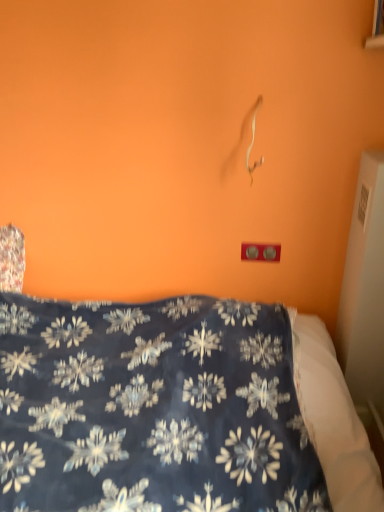
Consider the image. What is the approximate height of dark blue fabric at center?

dark blue fabric at center is 61.79 centimeters in height.

From the picture: Measure the distance between point (356, 458) and camera.

Answer: Point (356, 458) is 1.14 meters away from camera.

The image size is (384, 512). I want to click on dark blue fabric at center, so click(160, 410).

Image resolution: width=384 pixels, height=512 pixels. What do you see at coordinates (160, 410) in the screenshot? I see `dark blue fabric at center` at bounding box center [160, 410].

Where is `matte plastic outlet at center`? matte plastic outlet at center is located at coordinates (260, 252).

The height and width of the screenshot is (512, 384). Describe the element at coordinates (260, 252) in the screenshot. I see `matte plastic outlet at center` at that location.

What are the coordinates of `dark blue fabric at center` in the screenshot? It's located at (160, 410).

Is matte plastic outlet at center to the left of dark blue fabric at center from the viewer's perspective?

In fact, matte plastic outlet at center is to the right of dark blue fabric at center.

Consider the image. Is matte plastic outlet at center positioned before dark blue fabric at center?

No.

Looking at this image, which point is more distant from viewer, (272,249) or (289,466)?

Positioned behind is point (272,249).

From the image's perspective, is matte plastic outlet at center under dark blue fabric at center?

Incorrect, from the image's perspective, matte plastic outlet at center is higher than dark blue fabric at center.

From a real-world perspective, is matte plastic outlet at center beneath dark blue fabric at center?

No, from a real-world perspective, matte plastic outlet at center is not under dark blue fabric at center.

In the scene shown: Can you confirm if matte plastic outlet at center is wider than dark blue fabric at center?

No, matte plastic outlet at center is not wider than dark blue fabric at center.

Considering the relative sizes of matte plastic outlet at center and dark blue fabric at center in the image provided, is matte plastic outlet at center shorter than dark blue fabric at center?

Yes.

Which of these two, matte plastic outlet at center or dark blue fabric at center, is bigger?

dark blue fabric at center is bigger.

Would you say matte plastic outlet at center contains dark blue fabric at center?

That's incorrect, dark blue fabric at center is not inside matte plastic outlet at center.

Is matte plastic outlet at center with dark blue fabric at center?

No.

Is matte plastic outlet at center positioned with its back to dark blue fabric at center?

No, dark blue fabric at center is not at the back of matte plastic outlet at center.

How distant is matte plastic outlet at center from dark blue fabric at center?

The distance of matte plastic outlet at center from dark blue fabric at center is 28.18 inches.

Identify the location of electric outlet behind the dark blue fabric at center. (260, 252).

Considering the positions of objects dark blue fabric at center and matte plastic outlet at center in the image provided, who is more to the left, dark blue fabric at center or matte plastic outlet at center?

dark blue fabric at center.

Does dark blue fabric at center lie in front of matte plastic outlet at center?

Yes, dark blue fabric at center is in front of matte plastic outlet at center.

Considering the points (125, 483) and (243, 245), which point is behind, point (125, 483) or point (243, 245)?

Positioned behind is point (243, 245).

From the image's perspective, is dark blue fabric at center located beneath matte plastic outlet at center?

Yes, from the image's perspective, dark blue fabric at center is below matte plastic outlet at center.

From a real-world perspective, is dark blue fabric at center positioned under matte plastic outlet at center based on gravity?

Indeed, from a real-world perspective, dark blue fabric at center is positioned beneath matte plastic outlet at center.

Considering the relative sizes of dark blue fabric at center and matte plastic outlet at center in the image provided, is dark blue fabric at center thinner than matte plastic outlet at center?

No.

Is dark blue fabric at center taller than matte plastic outlet at center?

Yes, dark blue fabric at center is taller than matte plastic outlet at center.

Looking at this image, considering the relative sizes of dark blue fabric at center and matte plastic outlet at center in the image provided, is dark blue fabric at center smaller than matte plastic outlet at center?

No, dark blue fabric at center is not smaller than matte plastic outlet at center.

Is matte plastic outlet at center a part of dark blue fabric at center?

No, matte plastic outlet at center is not a part of dark blue fabric at center.

Is dark blue fabric at center in contact with matte plastic outlet at center?

There is a gap between dark blue fabric at center and matte plastic outlet at center.

Is dark blue fabric at center turned away from matte plastic outlet at center?

No, matte plastic outlet at center is not at the back of dark blue fabric at center.

Locate an element on the screen. bed that appears below the matte plastic outlet at center (from a real-world perspective) is located at coordinates (160, 410).

You are a GUI agent. You are given a task and a screenshot of the screen. Output one action in this format:
    pyautogui.click(x=<x>, y=<y>)
    Task: Click on the bed on the left of matte plastic outlet at center
    The height and width of the screenshot is (512, 384).
    Given the screenshot: What is the action you would take?
    pyautogui.click(x=160, y=410)

This screenshot has height=512, width=384. I want to click on bed in front of the matte plastic outlet at center, so (160, 410).